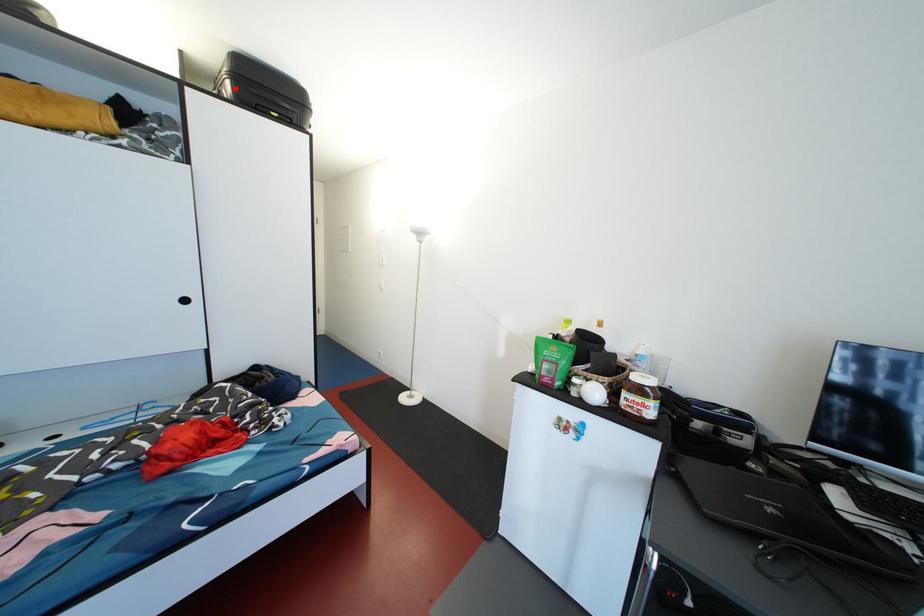
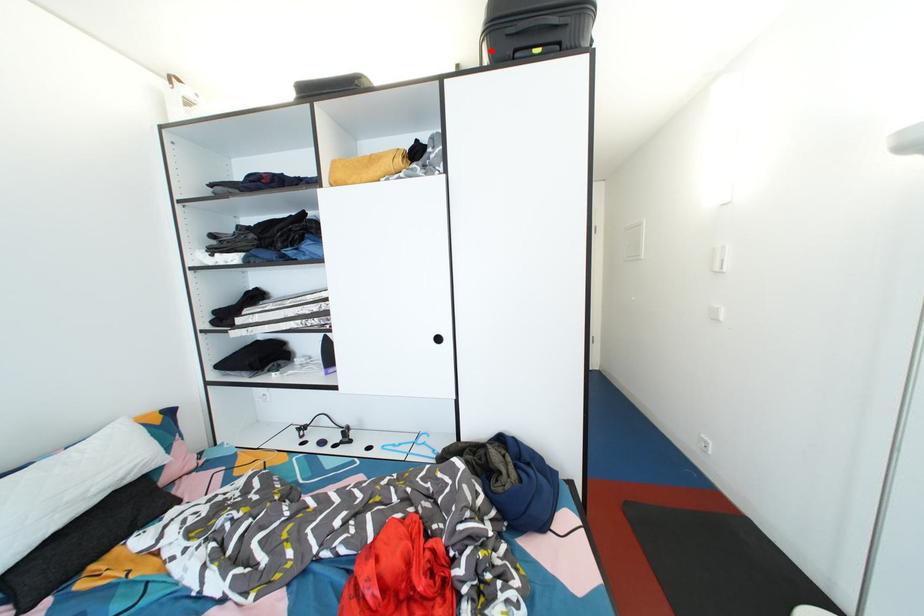
I am providing you with two images of the same scene from different viewpoints. A red point is marked on the first image and another point is marked on the second image. Does the point marked in image1 correspond to the same location as the one in image2?

Yes